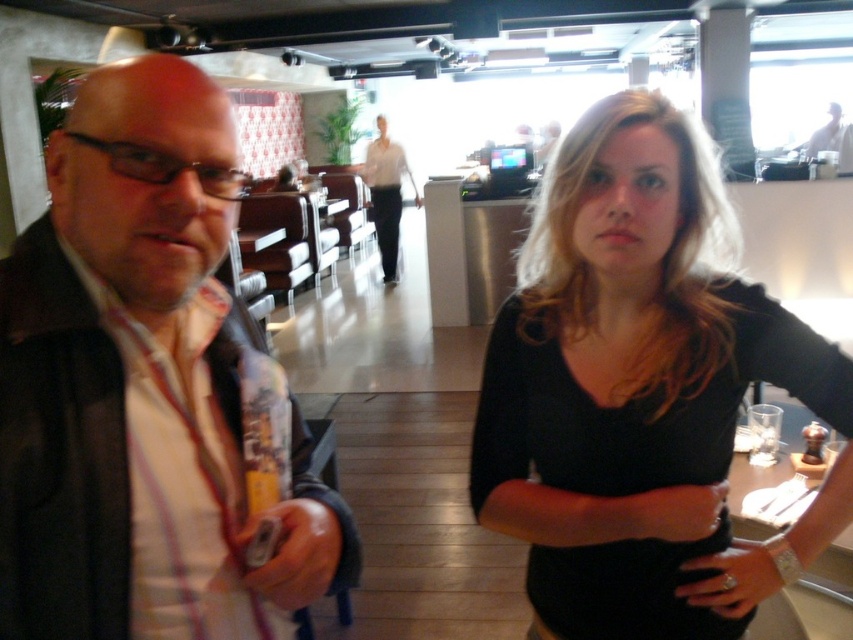
Consider the image. You are a photographer setting up for a group photo. You notice the matte black jacket at left and the black matte shirt at center. Which object should you adjust to ensure both are fully visible in the photo?

The matte black jacket at left is in front of the black matte shirt at center. To ensure both are fully visible, you should adjust the matte black jacket at left to move it out of the way so the black matte shirt at center is not blocked.

You are a photographer trying to capture a clear shot of both the black matte shirt at center and the matte white blouse at center. Since they are positioned close to each other, will you be able to focus on both subjects simultaneously without one blocking the other?

The black matte shirt at center is in front of the matte white blouse at center, so focusing on both simultaneously may be challenging as the black matte shirt at center would obscure part of the matte white blouse at center.

You are a photographer setting up for a group photo. You have two subjects wearing the matte black jacket at left and the black matte shirt at center. You need to arrange them so that their clothing items are visible. Given their height differences, which clothing item should be placed in front to ensure both are visible?

The matte black jacket at left is shorter than the black matte shirt at center. To ensure both are visible, the shorter matte black jacket at left should be placed in front of the taller black matte shirt at center.